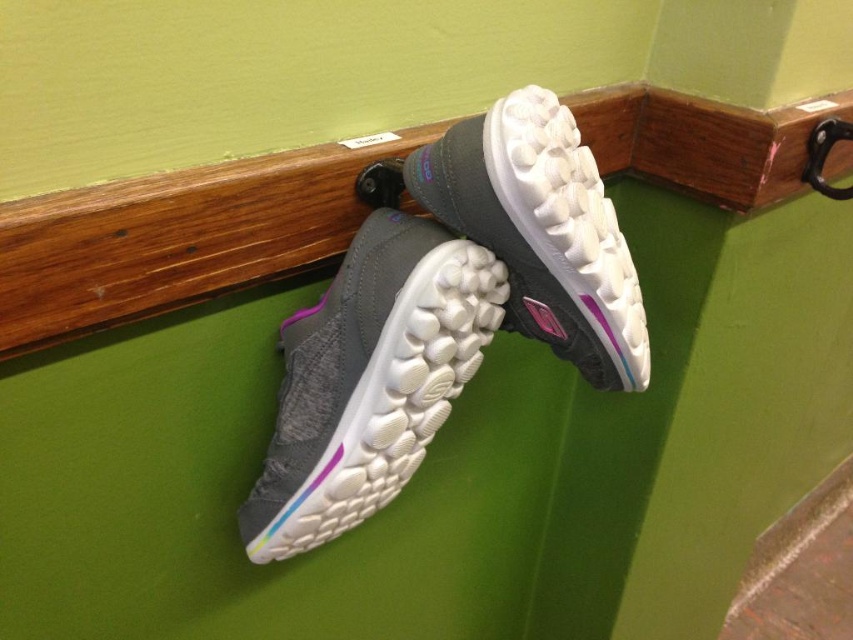
You are trying to place a small plant pot on the wooden ledge at upper center where the gray rubber shoe at center is currently resting. Can the shoe be moved to make space for the pot without disturbing the railing?

The wooden ledge at upper center is located above the gray rubber shoe at center, so moving the shoe from its current position under the ledge would create space for the plant pot. Yes, the shoe can be moved to allow the pot to be placed on the ledge.

You are a delivery person who needs to place a package on the railing where the shoes are located. The package must be placed above both the gray fabric shoe at center and the gray rubber shoe at center. Is there enough space between the two shoes for the package?

The gray fabric shoe at center is below the gray rubber shoe at center, so there is space between them. The package can be placed in that space above both shoes.